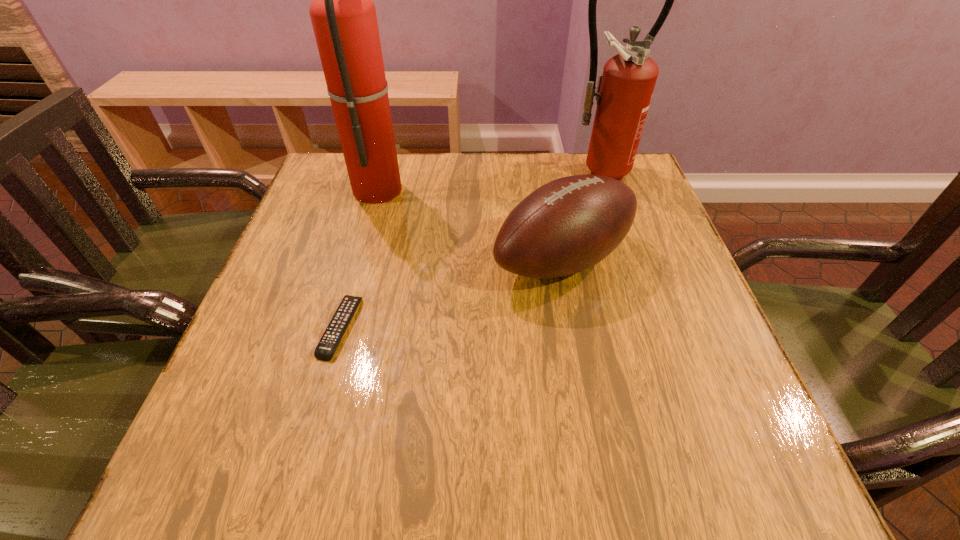
Where is `the left fire extinguisher`? The image size is (960, 540). the left fire extinguisher is located at coordinates (343, 15).

Find the location of `the right fire extinguisher`. the right fire extinguisher is located at coordinates (624, 91).

Where is `football (American)`? Image resolution: width=960 pixels, height=540 pixels. football (American) is located at coordinates (570, 224).

Image resolution: width=960 pixels, height=540 pixels. Identify the location of the shortest object. pyautogui.click(x=324, y=351).

Image resolution: width=960 pixels, height=540 pixels. I want to click on vacant point located with the nozzle and gauge on the left fire extinguisher, so click(422, 188).

Find the location of `vacant space located 0.110m at the nozzle of the right fire extinguisher`. vacant space located 0.110m at the nozzle of the right fire extinguisher is located at coordinates (609, 213).

Identify the location of free space located 0.050m on the front of the second shortest object. (574, 321).

The image size is (960, 540). Find the location of `free space located on the back of the shortest object`. free space located on the back of the shortest object is located at coordinates (371, 218).

Identify the location of fire extinguisher present at the left edge. Image resolution: width=960 pixels, height=540 pixels. (343, 15).

I want to click on remote control that is at the left edge, so click(x=324, y=351).